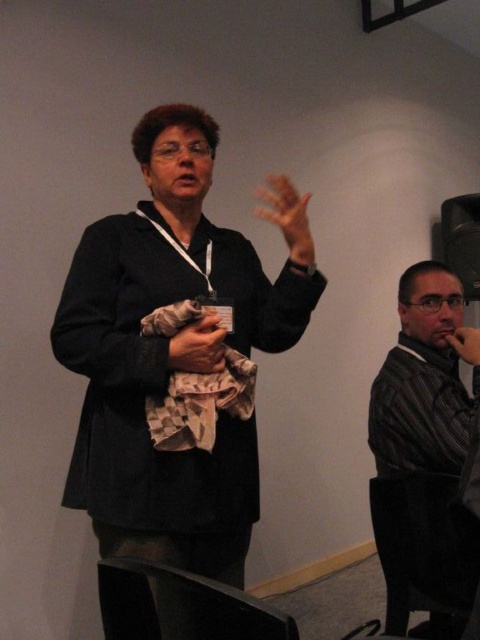
Based on the photo, you are an event organizer who needs to ensure that the presenter is visible to the audience. Based on the scene, is the matte black jacket at center covering the camouflage fabric hand at center?

The matte black jacket at center is located above the camouflage fabric hand at center, so it is covering the hand.

You are a photographer trying to capture a candid shot of the speaker. You need to ensure that both the matte black jacket at center and the matte black hand at center are in focus. Given that your camera can only maintain sharp focus within a 15 inch range, will both objects stay in focus?

The distance between the matte black jacket at center and the matte black hand at center is 15.92 inches. Since this exceeds the camera focus range of 15 inches, both objects cannot be in focus simultaneously.

You are an event organizer who needs to ensure that the presenter is visible to the audience. The presenter is wearing a matte black jacket at center and has a matte black hand at center raised. Which object is positioned to the right of the other?

The matte black hand at center is positioned to the right of the matte black jacket at center because the jacket is on the left side of the hand.